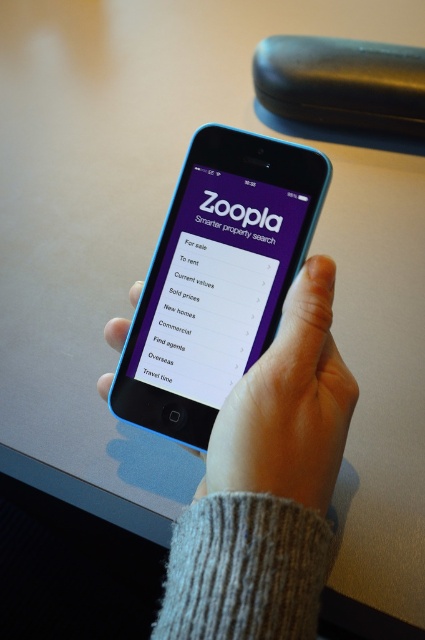
You have a small toy car that is 3 inches long. You want to move it from the gray knitted sweater at center to the purple matte screen at center. Can the toy car fit through the space between them?

The gray knitted sweater at center and purple matte screen at center are 3.35 inches apart. Since the toy car is 3 inches long, it can fit through the space between them as the distance is greater than the car length.

You are organizing your desk and want to place a book between the gray knitted sweater at center and the purple matte screen at center. Based on their heights, which object should the book be placed closer to?

The gray knitted sweater at center has a greater height compared to the purple matte screen at center, so the book should be placed closer to the purple matte screen at center to ensure stability.

You are trying to reach the blue plastic smartphone at center on the desk. There is a smooth skin hand at center in the way. Can you move your hand to pick up the phone without touching the hand?

The blue plastic smartphone at center is above the smooth skin hand at center, so you can move your hand to pick up the phone without touching the hand by sliding it underneath.